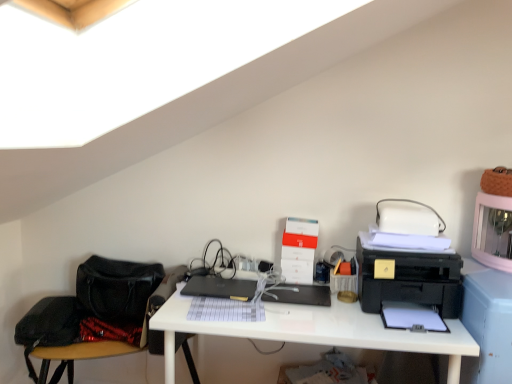
Where is `vacant area located to the right-hand side of black plastic register at center`? The height and width of the screenshot is (384, 512). vacant area located to the right-hand side of black plastic register at center is located at coordinates (351, 309).